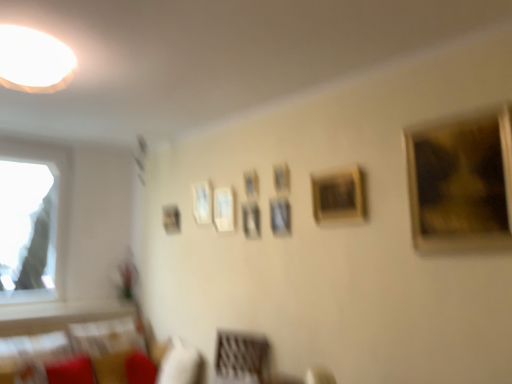
In order to face wooden photo frame at center, the 7th picture frame viewed from the left, should I rotate leftwards or rightwards?

Turn right approximately 3.408 degrees to face it.

Describe the element at coordinates (251, 220) in the screenshot. The image size is (512, 384). I see `wooden picture frame at center, acting as the fifth picture frame starting from the right` at that location.

This screenshot has width=512, height=384. Describe the element at coordinates (34, 60) in the screenshot. I see `white glossy light at upper left` at that location.

At what (x,y) coordinates should I click in order to perform the action: click on white glossy light at upper left. Please return your answer as a coordinate pair (x, y). Looking at the image, I should click on (34, 60).

What are the coordinates of `metallic silver picture frame at center, the 3th picture frame in the front-to-back sequence` in the screenshot? It's located at (280, 216).

This screenshot has width=512, height=384. Find the location of `matte white frame at upper center, which appears as the second picture frame when viewed from the left`. matte white frame at upper center, which appears as the second picture frame when viewed from the left is located at coordinates (202, 202).

Where is `wooden photo frame at center, arranged as the fourth picture frame when viewed from the front`? The width and height of the screenshot is (512, 384). wooden photo frame at center, arranged as the fourth picture frame when viewed from the front is located at coordinates (281, 178).

Would you consider wooden frame at center, marked as the 2th picture frame in a right-to-left arrangement, to be distant from gold textured painting at upper right, the 9th picture frame in the back-to-front sequence?

Actually, wooden frame at center, marked as the 2th picture frame in a right-to-left arrangement, and gold textured painting at upper right, the 9th picture frame in the back-to-front sequence, are a little close together.

In terms of size, does wooden frame at center, acting as the 8th picture frame starting from the back, appear bigger or smaller than gold textured painting at upper right, the 9th picture frame in the back-to-front sequence?

Clearly, wooden frame at center, acting as the 8th picture frame starting from the back, is smaller in size than gold textured painting at upper right, the 9th picture frame in the back-to-front sequence.

From the image's perspective, which is above, wooden frame at center, acting as the 8th picture frame starting from the back, or gold textured painting at upper right, the 1th picture frame positioned from the right?

gold textured painting at upper right, the 1th picture frame positioned from the right.

Based on their positions, is wooden frame at center, marked as the 2th picture frame in a right-to-left arrangement, located to the left or right of gold textured painting at upper right, arranged as the 9th picture frame when viewed from the left?

wooden frame at center, marked as the 2th picture frame in a right-to-left arrangement, is to the left of gold textured painting at upper right, arranged as the 9th picture frame when viewed from the left.

In terms of height, does wooden photo frame at center, which is counted as the 6th picture frame, starting from the front, look taller or shorter compared to wooden picture frame at center, acting as the fifth picture frame starting from the right?

Clearly, wooden photo frame at center, which is counted as the 6th picture frame, starting from the front, is shorter compared to wooden picture frame at center, acting as the fifth picture frame starting from the right.

Visually, is wooden photo frame at center, which is counted as the 6th picture frame, starting from the front, positioned to the left or to the right of wooden picture frame at center, acting as the fifth picture frame starting from the right?

In the image, wooden photo frame at center, which is counted as the 6th picture frame, starting from the front, appears on the left side of wooden picture frame at center, acting as the fifth picture frame starting from the right.

Is wooden photo frame at center, the fourth picture frame in the left-to-right sequence, further to the viewer compared to wooden picture frame at center, acting as the fifth picture frame starting from the right?

Yes, wooden photo frame at center, the fourth picture frame in the left-to-right sequence, is further from the viewer.

Is point (244, 182) closer to viewer compared to point (244, 229)?

No, (244, 182) is further to viewer.

Does metallic silver picture frame at center, which appears as the 6th picture frame when viewed from the left, come in front of wooden frame at center, the second picture frame when ordered from front to back?

No, the depth of metallic silver picture frame at center, which appears as the 6th picture frame when viewed from the left, is greater than that of wooden frame at center, the second picture frame when ordered from front to back.

Which of these two, metallic silver picture frame at center, which appears as the 6th picture frame when viewed from the left, or wooden frame at center, the second picture frame when ordered from front to back, is bigger?

wooden frame at center, the second picture frame when ordered from front to back, is bigger.

In terms of width, does metallic silver picture frame at center, arranged as the seventh picture frame when viewed from the back, look wider or thinner when compared to wooden frame at center, acting as the 8th picture frame starting from the back?

metallic silver picture frame at center, arranged as the seventh picture frame when viewed from the back, is thinner than wooden frame at center, acting as the 8th picture frame starting from the back.

Would you consider metallic silver picture frame at center, which appears as the 6th picture frame when viewed from the left, to be distant from wooden frame at center, the second picture frame when ordered from front to back?

Actually, metallic silver picture frame at center, which appears as the 6th picture frame when viewed from the left, and wooden frame at center, the second picture frame when ordered from front to back, are a little close together.

Is wooden photo frame at center, the 7th picture frame viewed from the left, not near velvet beige couch at lower left?

wooden photo frame at center, the 7th picture frame viewed from the left, is positioned a significant distance from velvet beige couch at lower left.

From a real-world perspective, is wooden photo frame at center, arranged as the fourth picture frame when viewed from the front, physically below velvet beige couch at lower left?

No.

From the image's perspective, which one is positioned higher, wooden photo frame at center, arranged as the fourth picture frame when viewed from the front, or velvet beige couch at lower left?

wooden photo frame at center, arranged as the fourth picture frame when viewed from the front, from the image's perspective.

Can you confirm if wooden photo frame at center, arranged as the fourth picture frame when viewed from the front, is wider than velvet beige couch at lower left?

No.

Which object is closer to the camera taking this photo, wooden photo frame at center, acting as the 3th picture frame starting from the right, or white glossy light at upper left?

white glossy light at upper left is more forward.

Are wooden photo frame at center, the 7th picture frame viewed from the left, and white glossy light at upper left far apart?

wooden photo frame at center, the 7th picture frame viewed from the left, is far away from white glossy light at upper left.

Considering the sizes of wooden photo frame at center, arranged as the fourth picture frame when viewed from the front, and white glossy light at upper left in the image, is wooden photo frame at center, arranged as the fourth picture frame when viewed from the front, bigger or smaller than white glossy light at upper left?

wooden photo frame at center, arranged as the fourth picture frame when viewed from the front, is smaller than white glossy light at upper left.

From the image's perspective, which is below, wooden photo frame at center, arranged as the fourth picture frame when viewed from the front, or white glossy light at upper left?

wooden photo frame at center, arranged as the fourth picture frame when viewed from the front, is shown below in the image.

Between white glossy light at upper left and wooden frame at center, marked as the 2th picture frame in a right-to-left arrangement, which one appears on the left side from the viewer's perspective?

Positioned to the left is white glossy light at upper left.

Between point (37, 82) and point (353, 182), which one is positioned behind?

The point (353, 182) is behind.

Is there a large distance between white glossy light at upper left and wooden frame at center, which is counted as the eighth picture frame, starting from the left?

Absolutely, white glossy light at upper left is distant from wooden frame at center, which is counted as the eighth picture frame, starting from the left.

This screenshot has height=384, width=512. I want to click on window behind the velvet beige couch at lower left, so click(x=33, y=221).

Who is bigger, transparent glass window at left or velvet beige couch at lower left?

Bigger between the two is velvet beige couch at lower left.

Between transparent glass window at left and velvet beige couch at lower left, which one has less height?

velvet beige couch at lower left.

From a real-world perspective, is transparent glass window at left above or below velvet beige couch at lower left?

transparent glass window at left is situated higher than velvet beige couch at lower left in the real world.

There is a gold textured painting at upper right, the 9th picture frame in the back-to-front sequence. Where is `the 1st picture frame below it (from the image's perspective)`? the 1st picture frame below it (from the image's perspective) is located at coordinates (339, 196).

From the image's perspective, count 6th picture frames upward from the wooden picture frame at center, acting as the 5th picture frame starting from the left, and point to it. Please provide its 2D coordinates.

[(251, 184)]

Considering their positions, is wooden photo frame at center, which is the 6th picture frame in right-to-left order, positioned closer to metallic silver picture frame at center, which appears as the 6th picture frame when viewed from the left, than matte white picture frame at center, placed as the 3th picture frame when sorted from back to front?

The object closer to metallic silver picture frame at center, which appears as the 6th picture frame when viewed from the left, is wooden photo frame at center, which is the 6th picture frame in right-to-left order.

Estimate the real-world distances between objects in this image. Which object is further from gold textured painting at upper right, arranged as the 9th picture frame when viewed from the left, velvet beige couch at lower left or matte white picture frame at center, positioned as the seventh picture frame in right-to-left order?

The object further to gold textured painting at upper right, arranged as the 9th picture frame when viewed from the left, is velvet beige couch at lower left.

Looking at the image, which one is located closer to metallic silver picture frame at center, the 3th picture frame in the front-to-back sequence, wooden picture frame at center, acting as the fifth picture frame starting from the right, or wooden photo frame at center, the fourth picture frame in the left-to-right sequence?

Among the two, wooden picture frame at center, acting as the fifth picture frame starting from the right, is located nearer to metallic silver picture frame at center, the 3th picture frame in the front-to-back sequence.

Estimate the real-world distances between objects in this image. Which object is further from wooden frame at center, marked as the 2th picture frame in a right-to-left arrangement, velvet beige couch at lower left or metallic silver picture frame at center, arranged as the seventh picture frame when viewed from the back?

Based on the image, velvet beige couch at lower left appears to be further to wooden frame at center, marked as the 2th picture frame in a right-to-left arrangement.

Estimate the real-world distances between objects in this image. Which object is closer to matte white frame at upper center, which appears as the second picture frame when viewed from the left, white glossy light at upper left or matte black picture frame at upper center, which is counted as the 1th picture frame, starting from the back?

The object closer to matte white frame at upper center, which appears as the second picture frame when viewed from the left, is matte black picture frame at upper center, which is counted as the 1th picture frame, starting from the back.

In the scene shown: Which object lies further to the anchor point wooden photo frame at center, which is counted as the 6th picture frame, starting from the front, metallic silver picture frame at center, positioned as the 4th picture frame in right-to-left order, or wooden photo frame at center, the 7th picture frame viewed from the left?

metallic silver picture frame at center, positioned as the 4th picture frame in right-to-left order, is further to wooden photo frame at center, which is counted as the 6th picture frame, starting from the front.

Based on the photo, from the image, which object appears to be farther from matte white picture frame at center, acting as the 7th picture frame starting from the front, wooden frame at center, marked as the 2th picture frame in a right-to-left arrangement, or white glossy light at upper left?

Based on the image, white glossy light at upper left appears to be further to matte white picture frame at center, acting as the 7th picture frame starting from the front.

Which object lies nearer to the anchor point white glossy light at upper left, transparent glass window at left or matte black picture frame at upper center, which is counted as the 1th picture frame, starting from the back?

matte black picture frame at upper center, which is counted as the 1th picture frame, starting from the back, lies closer to white glossy light at upper left than the other object.

This screenshot has width=512, height=384. Identify the location of picture frame between matte white frame at upper center, arranged as the 8th picture frame when viewed from the front, and wooden photo frame at center, which is counted as the 6th picture frame, starting from the front. (224, 209).

Locate an element on the screen. The image size is (512, 384). light between transparent glass window at left and wooden photo frame at center, acting as the 3th picture frame starting from the right is located at coordinates (34, 60).

Identify the location of light between transparent glass window at left and wooden frame at center, acting as the 8th picture frame starting from the back. (34, 60).

Find the location of a particular element. This screenshot has width=512, height=384. couch between transparent glass window at left and gold textured painting at upper right, the 9th picture frame in the back-to-front sequence is located at coordinates (80, 333).